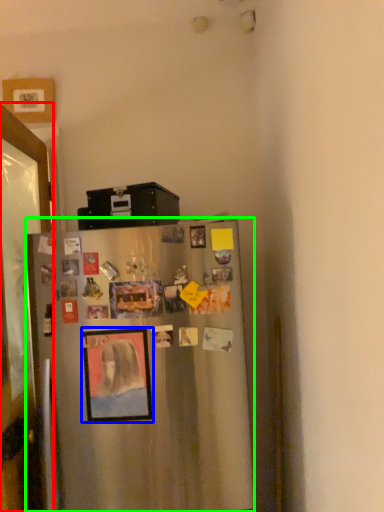
Question: Based on their relative distances, which object is nearer to glass door (highlighted by a red box)? Choose from picture frame (highlighted by a blue box) and refrigerator (highlighted by a green box).

Choices:
 (A) picture frame
 (B) refrigerator

Answer: (A)